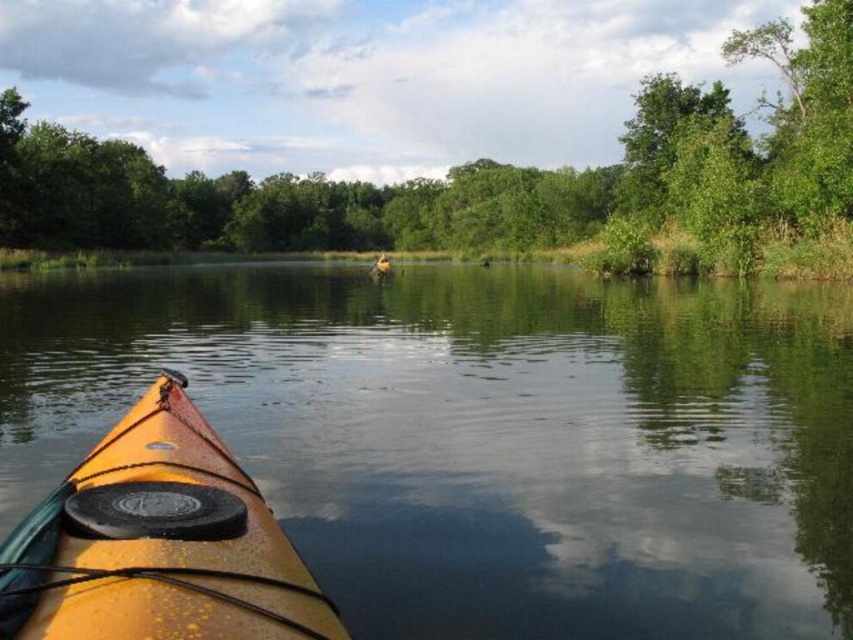
Can you confirm if green leafy tree at center is smaller than matte yellow kayak at lower left?

No.

Does green leafy tree at center appear on the left side of matte yellow kayak at lower left?

Incorrect, green leafy tree at center is not on the left side of matte yellow kayak at lower left.

Which is in front, point (814, 204) or point (184, 380)?

Point (184, 380) is more forward.

I want to click on green leafy tree at center, so click(498, 180).

From the picture: Does smooth water at center have a smaller size compared to matte yellow kayak at lower left?

No.

Between point (415, 516) and point (192, 616), which one is positioned in front?

Positioned in front is point (192, 616).

Does point (815, 572) lie behind point (132, 445)?

That is True.

I want to click on smooth water at center, so click(x=483, y=435).

Does smooth water at center appear over green leafy tree at center?

No, smooth water at center is not above green leafy tree at center.

Measure the distance between smooth water at center and camera.

smooth water at center is 6.83 meters away from camera.

Between point (798, 538) and point (200, 32), which one is positioned behind?

The point (200, 32) is more distant.

This screenshot has width=853, height=640. What are the coordinates of `smooth water at center` in the screenshot? It's located at (483, 435).